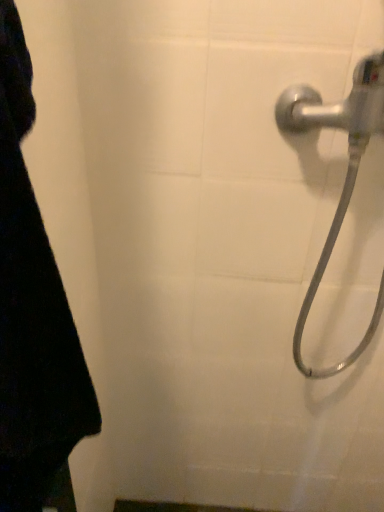
The height and width of the screenshot is (512, 384). What do you see at coordinates (32, 310) in the screenshot? I see `black fabric dress at left` at bounding box center [32, 310].

I want to click on black fabric dress at left, so click(32, 310).

Image resolution: width=384 pixels, height=512 pixels. In order to click on black fabric dress at left in this screenshot , I will do `click(32, 310)`.